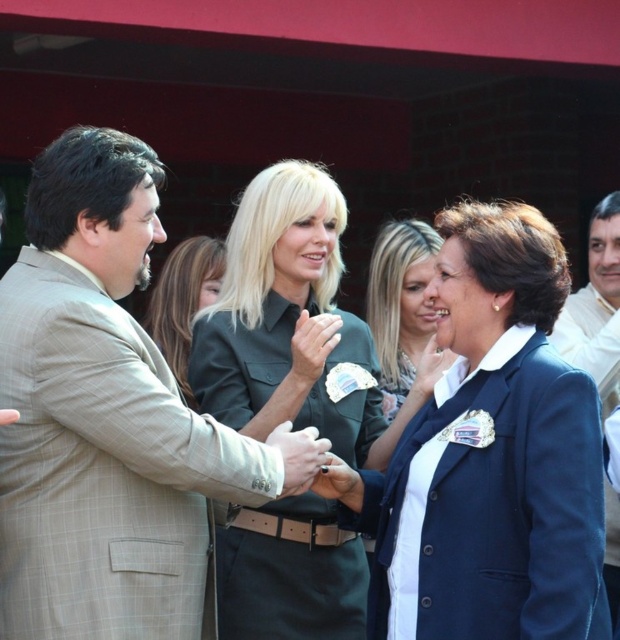
You are a photographer standing at the center of the scene. You need to take a photo of the two people shaking hands and the green uniform at center. Given that your camera has a maximum focus range of 5 meters, will you be able to capture all three subjects clearly in one shot?

The two people shaking hands and the green uniform at center are 4.79 meters apart. Since the camera can focus up to 5 meters, all three subjects are within the focus range and can be captured clearly in one shot.

You are standing in the scene and want to locate the green uniform at center. Which direction should you look to find it?

The green uniform at center is located at the center of the scene, so you should look straight ahead to find it.